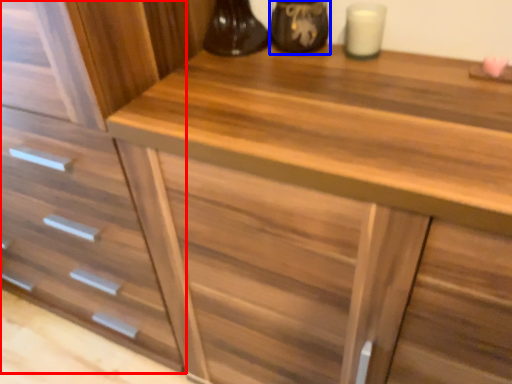
Question: Which object is further to the camera taking this photo, drawer (highlighted by a red box) or appliance (highlighted by a blue box)?

Choices:
 (A) drawer
 (B) appliance

Answer: (B)